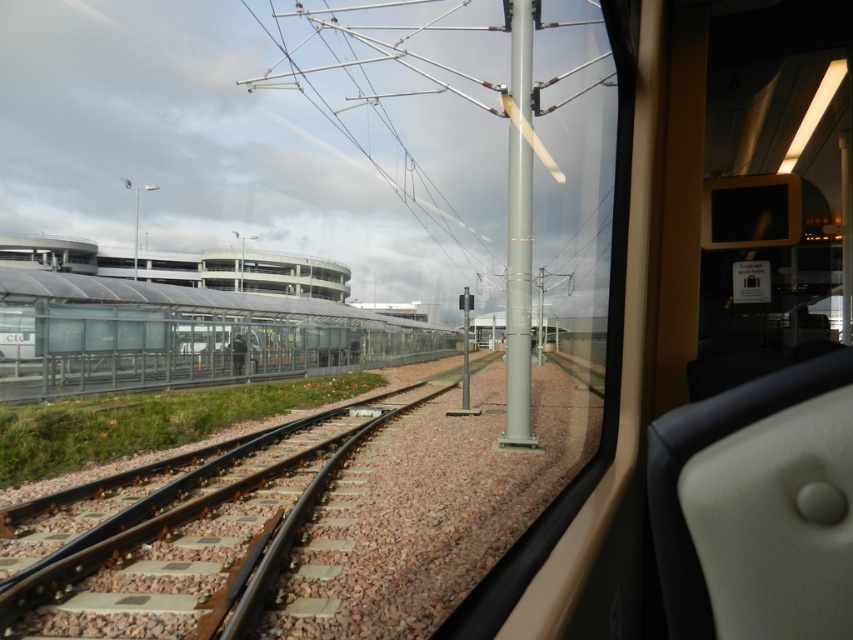
You are standing at the center of the platform and want to board the transparent glass train at left. Based on the scene description, which direction should you walk to reach it?

The transparent glass train at left is located at point [183,336], so you should walk towards the left side of the platform to reach it.

You are a passenger sitting in the train and want to know if you can safely walk from the transparent glass train window at center to the transparent glass train at left without stepping outside the train. Can you do this?

The distance between the transparent glass train window at center and the transparent glass train at left is 22.07 meters, so yes, you can safely walk between them as they are both part of the same train.